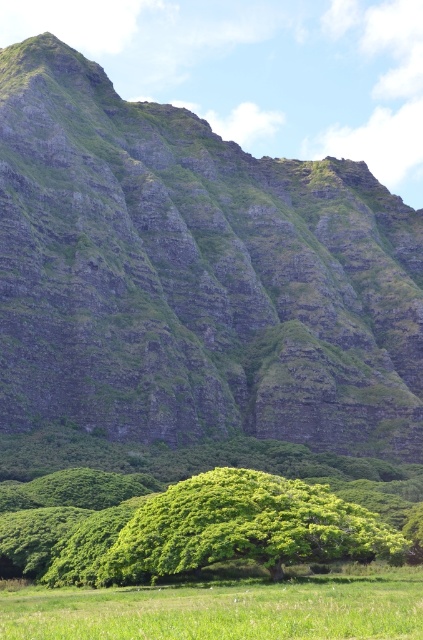
Question: Which point is farther to the camera?

Choices:
 (A) green leafy tree at center
 (B) green grassy mountain at upper center

Answer: (B)

Question: Does green grassy mountain at upper center lie behind green leafy tree at center?

Choices:
 (A) yes
 (B) no

Answer: (A)

Question: Which of these objects is positioned closest to the green leafy tree at center?

Choices:
 (A) green grassy mountain at upper center
 (B) green grass at lower center

Answer: (B)

Question: Among these objects, which one is farthest from the camera?

Choices:
 (A) green grass at lower center
 (B) green grassy mountain at upper center
 (C) green leafy tree at center

Answer: (B)

Question: Does green grass at lower center have a greater width compared to green leafy tree at center?

Choices:
 (A) yes
 (B) no

Answer: (A)

Question: Can you confirm if green grass at lower center is positioned to the right of green leafy tree at center?

Choices:
 (A) no
 (B) yes

Answer: (A)